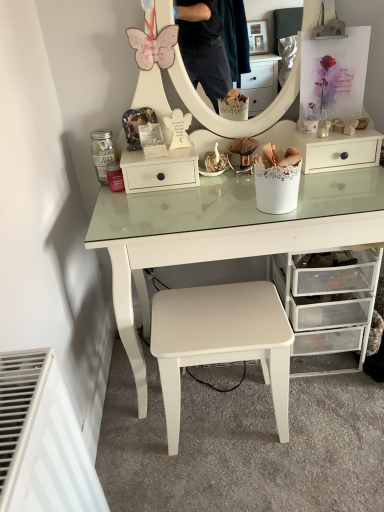
This screenshot has width=384, height=512. What are the coordinates of `vacant region above white matte drawer at center (from a real-world perspective)` in the screenshot? It's located at pos(157,151).